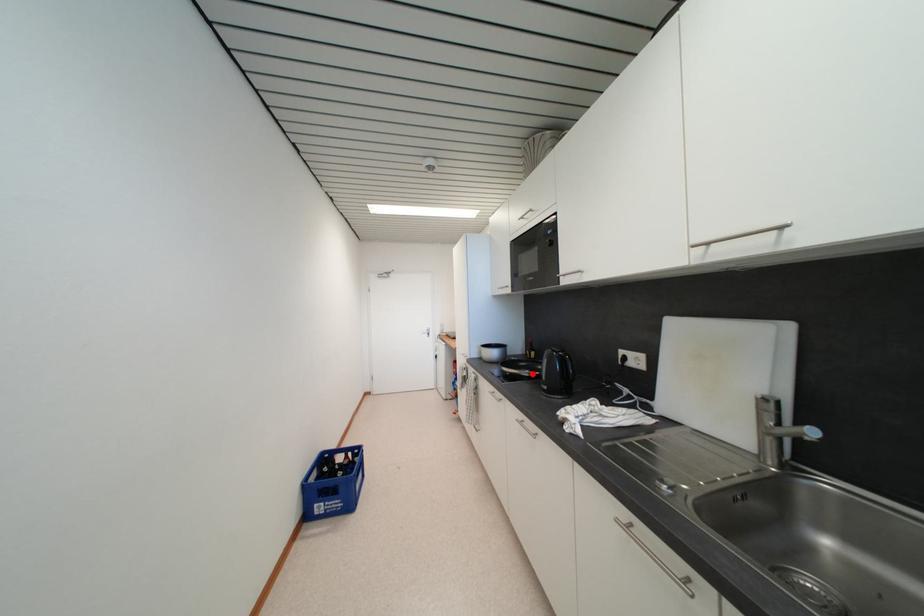
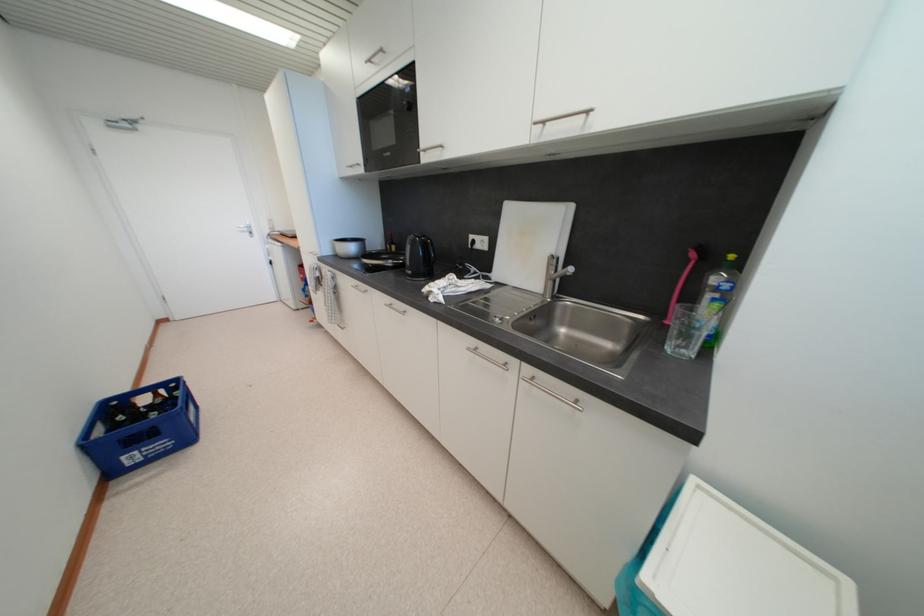
The point at the highlighted location is marked in the first image. Where is the corresponding point in the second image?

(395, 264)